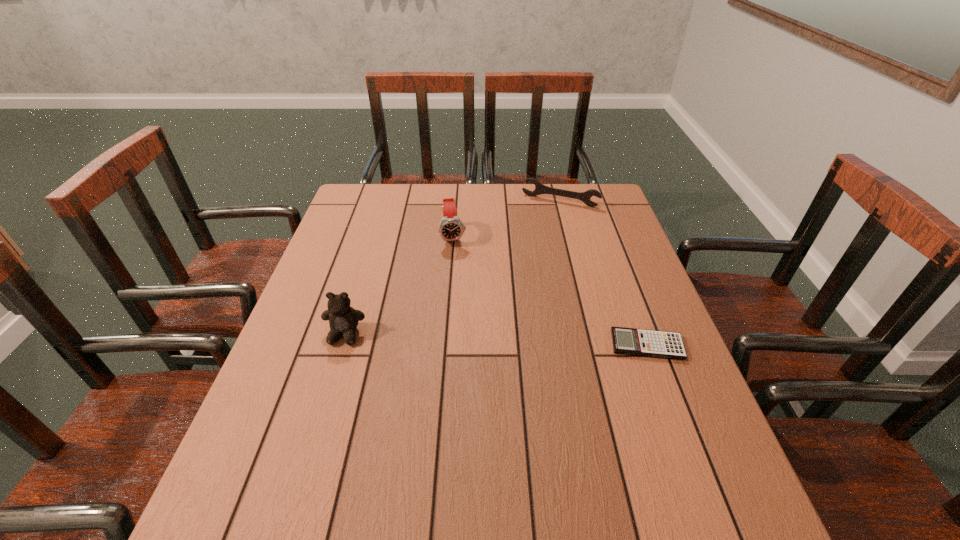
This screenshot has height=540, width=960. What are the coordinates of `vacant region at the left edge of the desktop` in the screenshot? It's located at (328, 321).

The height and width of the screenshot is (540, 960). What are the coordinates of `vacant space at the right edge of the desktop` in the screenshot? It's located at [635, 291].

Image resolution: width=960 pixels, height=540 pixels. I want to click on vacant region at the far left corner, so click(x=363, y=192).

In the image, there is a desktop. At what (x,y) coordinates should I click in order to perform the action: click on vacant space at the near right corner. Please return your answer as a coordinate pair (x, y). The height and width of the screenshot is (540, 960). Looking at the image, I should click on click(705, 439).

The width and height of the screenshot is (960, 540). In order to click on free space between the teddy bear and the shortest object in this screenshot , I will do `click(495, 340)`.

Identify the location of vacant space that's between the shortest object and the wrench. (603, 273).

This screenshot has height=540, width=960. In order to click on blank region between the shortest object and the wrench in this screenshot , I will do `click(603, 273)`.

Where is `free area in between the second shortest object and the third object from right to left`? free area in between the second shortest object and the third object from right to left is located at coordinates (507, 219).

The height and width of the screenshot is (540, 960). I want to click on unoccupied position between the calculator and the second shortest object, so click(603, 273).

Locate an element on the screen. empty location between the calculator and the wrench is located at coordinates (603, 273).